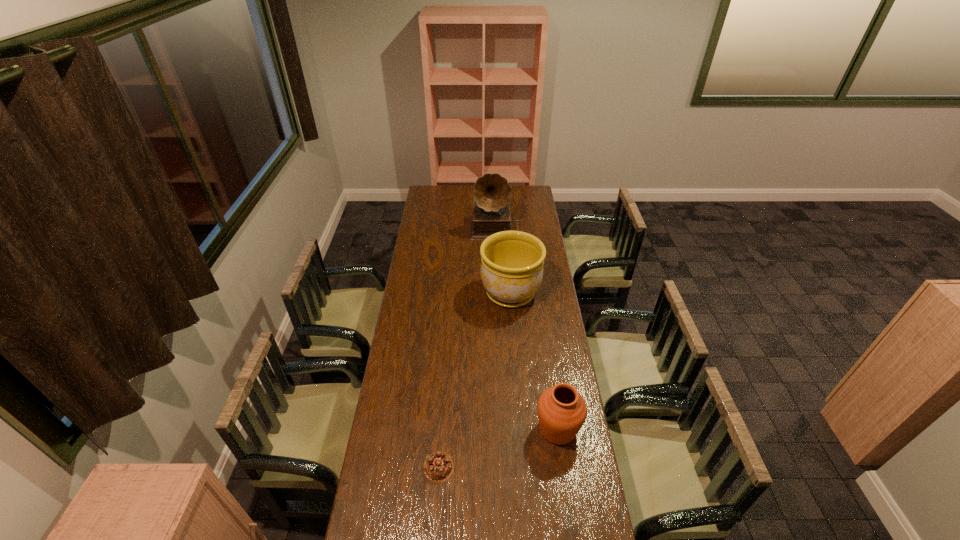
Locate an element on the screen. free space between the second shortest object and the chocolate cake is located at coordinates (498, 448).

Find the location of a particular element. The width and height of the screenshot is (960, 540). free space between the leftmost object and the record player is located at coordinates (468, 347).

This screenshot has width=960, height=540. What are the coordinates of `empty space between the chocolate cake and the third shortest object` in the screenshot? It's located at (475, 380).

The image size is (960, 540). Find the location of `free space between the second nearest object and the flowerpot`. free space between the second nearest object and the flowerpot is located at coordinates (534, 361).

This screenshot has height=540, width=960. I want to click on vacant area that lies between the flowerpot and the second shortest object, so click(x=534, y=361).

In order to click on the second closest object to the nearest object in this screenshot , I will do `click(511, 270)`.

Select which object appears as the second closest to the shortest object. Please provide its 2D coordinates. Your answer should be formatted as a tuple, i.e. [(x, y)], where the tuple contains the x and y coordinates of a point satisfying the conditions above.

[(511, 270)]

Find the location of a particular element. The height and width of the screenshot is (540, 960). free spot that satisfies the following two spatial constraints: 1. from the horn of the urn; 2. on the right side of the farthest object is located at coordinates (505, 429).

I want to click on vacant area in the image that satisfies the following two spatial constraints: 1. from the horn of the second shortest object; 2. on the left side of the farthest object, so click(505, 429).

Where is `free point that satisfies the following two spatial constraints: 1. from the horn of the second shortest object; 2. on the right side of the record player`? This screenshot has width=960, height=540. free point that satisfies the following two spatial constraints: 1. from the horn of the second shortest object; 2. on the right side of the record player is located at coordinates (505, 429).